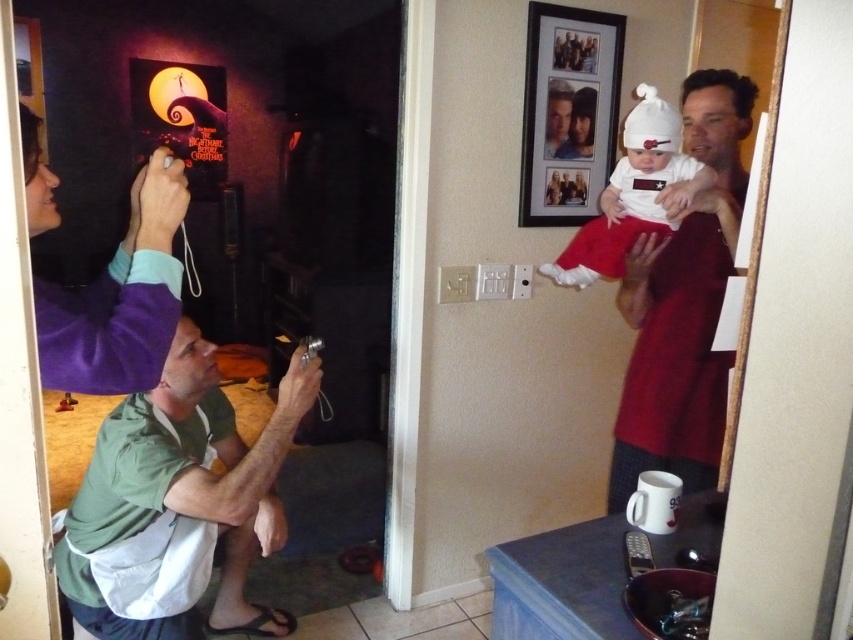
Can you confirm if wooden framed photo at upper center is shorter than white cotton baby at upper right?

In fact, wooden framed photo at upper center may be taller than white cotton baby at upper right.

Can you confirm if wooden framed photo at upper center is positioned to the right of white cotton baby at upper right?

No, wooden framed photo at upper center is not to the right of white cotton baby at upper right.

Does point (541, 116) come in front of point (602, 244)?

No, (541, 116) is further to viewer.

Identify the location of wooden framed photo at upper center. The height and width of the screenshot is (640, 853). (567, 113).

Who is taller, matte red shirt at right or white cotton baby at upper right?

Standing taller between the two is matte red shirt at right.

Can you confirm if matte red shirt at right is thinner than white cotton baby at upper right?

Indeed, matte red shirt at right has a lesser width compared to white cotton baby at upper right.

Between point (692, 282) and point (610, 262), which one is positioned in front?

Point (692, 282)

Find the location of a particular element. The height and width of the screenshot is (640, 853). matte red shirt at right is located at coordinates (683, 305).

Can you confirm if green fabric shirt at lower left is bigger than wooden framed photo at upper center?

Indeed, green fabric shirt at lower left has a larger size compared to wooden framed photo at upper center.

Is point (132, 480) more distant than point (548, 116)?

No, it is not.

Find the location of a particular element. This screenshot has height=640, width=853. green fabric shirt at lower left is located at coordinates (184, 486).